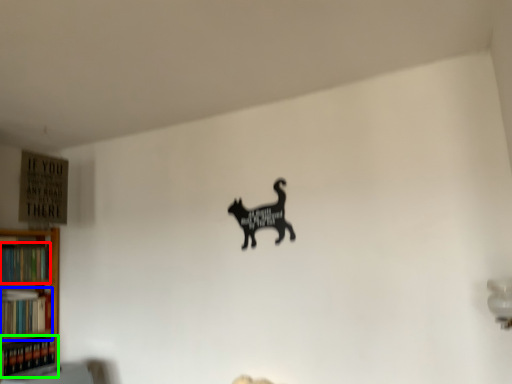
Question: Based on their relative distances, which object is farther from book (highlighted by a red box)? Choose from book (highlighted by a blue box) and book (highlighted by a green box).

Choices:
 (A) book
 (B) book

Answer: (B)